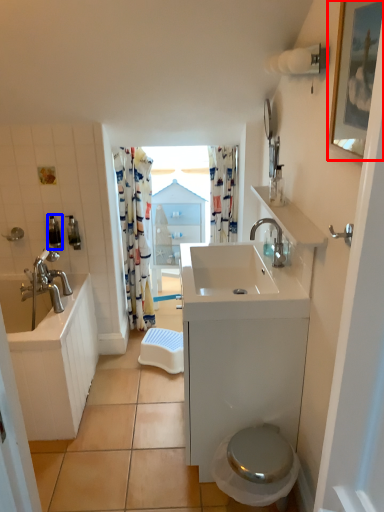
Question: Which object appears closest to the camera in this image, picture frame (highlighted by a red box) or toiletry (highlighted by a blue box)?

Choices:
 (A) picture frame
 (B) toiletry

Answer: (A)